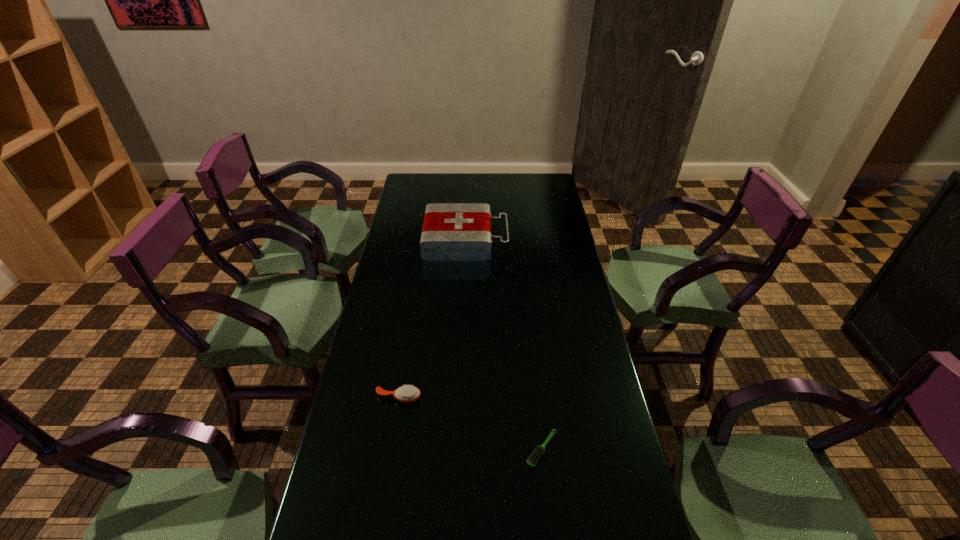
Where is `hairbrush at the left edge`? hairbrush at the left edge is located at coordinates (407, 394).

What are the coordinates of `vacant space at the left edge of the desktop` in the screenshot? It's located at (400, 341).

Where is `free point at the right edge`? The width and height of the screenshot is (960, 540). free point at the right edge is located at coordinates (600, 420).

Find the location of a particular element. This screenshot has width=960, height=540. empty space that is in between the right hairbrush and the farthest object is located at coordinates (504, 345).

Find the location of `free space between the tallest object and the taller hairbrush`. free space between the tallest object and the taller hairbrush is located at coordinates (432, 319).

Locate an element on the screen. This screenshot has width=960, height=540. unoccupied area between the farthest object and the second shortest object is located at coordinates (432, 319).

At what (x,y) coordinates should I click in order to perform the action: click on vacant space in between the tallest object and the second nearest object. Please return your answer as a coordinate pair (x, y). The image size is (960, 540). Looking at the image, I should click on pos(432,319).

The width and height of the screenshot is (960, 540). I want to click on vacant space in between the nearer hairbrush and the farther hairbrush, so click(x=470, y=423).

Locate an element on the screen. empty space that is in between the first-aid kit and the shorter hairbrush is located at coordinates (504, 345).

The height and width of the screenshot is (540, 960). Identify the location of free space that is in between the farther hairbrush and the tallest object. (432, 319).